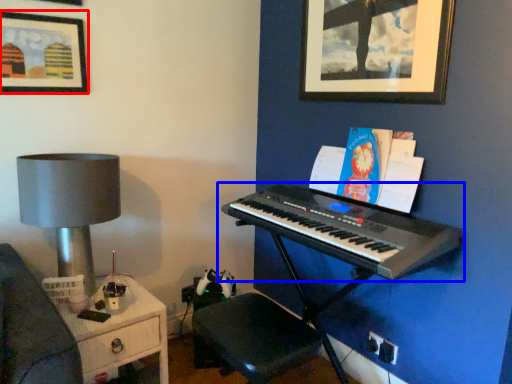
Question: Which object appears farthest to the camera in this image, picture frame (highlighted by a red box) or musical keyboard (highlighted by a blue box)?

Choices:
 (A) picture frame
 (B) musical keyboard

Answer: (A)